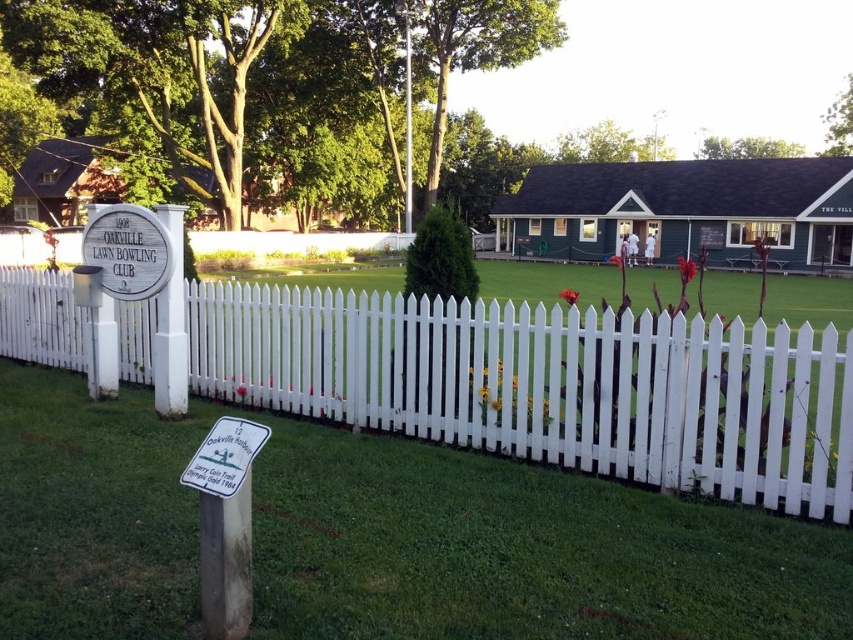
This screenshot has height=640, width=853. What do you see at coordinates (378, 538) in the screenshot?
I see `green grass at center` at bounding box center [378, 538].

Can you confirm if green grass at center is positioned above green mossy pole at center?

Incorrect, green grass at center is not positioned above green mossy pole at center.

What are the coordinates of `green grass at center` in the screenshot? It's located at (378, 538).

Is green grass at center to the right of white picket fence at center from the viewer's perspective?

Correct, you'll find green grass at center to the right of white picket fence at center.

Can you confirm if green grass at center is wider than white picket fence at center?

In fact, green grass at center might be narrower than white picket fence at center.

Is point (339, 470) in front of point (424, 328)?

That is True.

This screenshot has height=640, width=853. In order to click on green grass at center in this screenshot , I will do `click(378, 538)`.

Does point (265, 429) come closer to viewer compared to point (404, 67)?

Yes.

Measure the distance between white plastic sign at lower center and camera.

white plastic sign at lower center and camera are 9.10 feet apart from each other.

Locate an element on the screen. The height and width of the screenshot is (640, 853). white plastic sign at lower center is located at coordinates (224, 456).